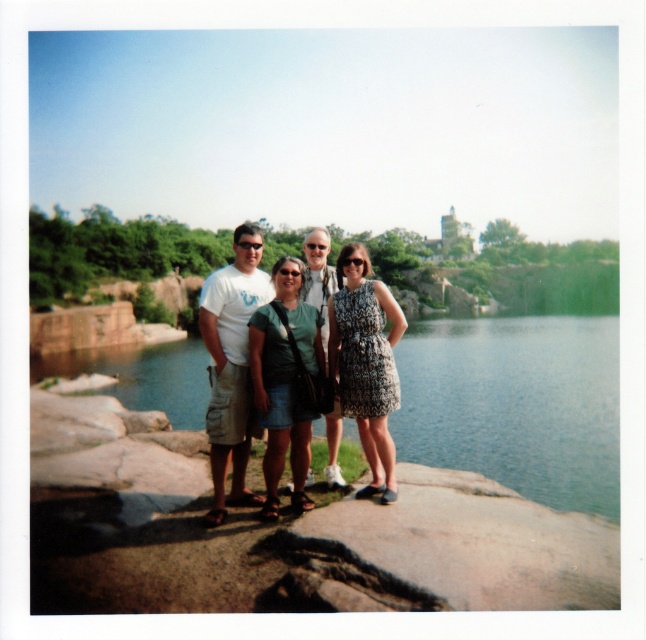
Question: Considering the relative positions of green water at lower center and light gray fabric shirt at center in the image provided, where is green water at lower center located with respect to light gray fabric shirt at center?

Choices:
 (A) above
 (B) below

Answer: (B)

Question: Among these points, which one is nearest to the camera?

Choices:
 (A) (253, 252)
 (B) (276, 440)

Answer: (B)

Question: Is matte green dress at center to the left of light gray fabric shirt at center from the viewer's perspective?

Choices:
 (A) no
 (B) yes

Answer: (B)

Question: Is matte green dress at center above patterned fabric dress at center?

Choices:
 (A) yes
 (B) no

Answer: (A)

Question: Estimate the real-world distances between objects in this image. Which object is farther from the green water at lower center?

Choices:
 (A) white cotton t-shirt at center
 (B) matte green dress at center
 (C) light gray fabric shirt at center
 (D) patterned fabric dress at center

Answer: (C)

Question: Which point is farther to the camera?

Choices:
 (A) (386, 481)
 (B) (313, 301)

Answer: (B)